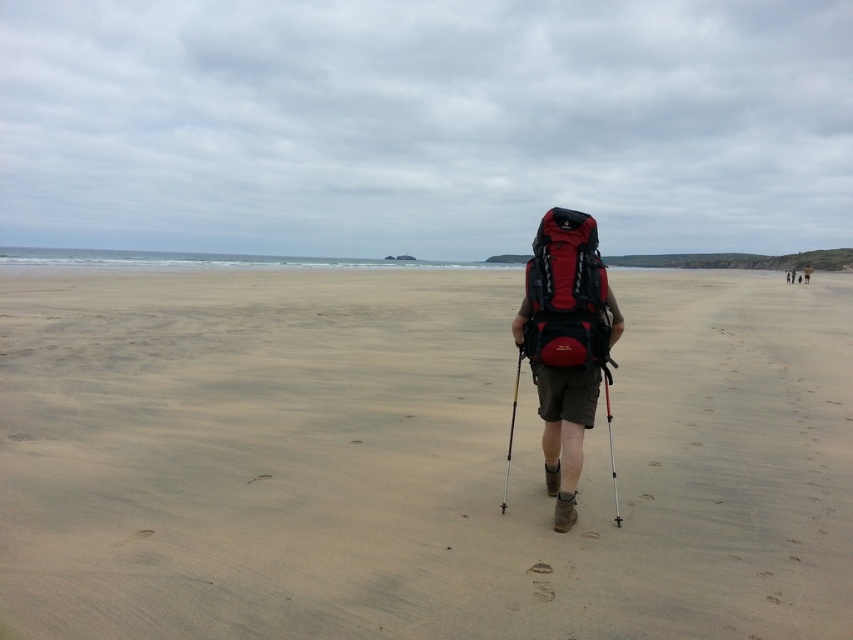
You are a photographer trying to capture the smooth sand at center and the red matte backpack at center in a single shot. Which object should you focus on first to ensure both are in sharp focus?

The smooth sand at center is closer to the viewer than the red matte backpack at center. To ensure both are in sharp focus, you should focus on the smooth sand at center first, as focusing on closer objects sets the focal plane to include both near and far subjects.

You are a photographer standing on the beach. You want to take a picture of the smooth sand at center and the red matte backpack at center so that both are clearly visible in the frame. Given that your camera has a maximum focus range of 5 meters, will you be able to capture both objects in focus at the same time?

The smooth sand at center and red matte backpack at center are 6.75 meters apart. Since the camera can only focus within 5 meters, the distance between them exceeds the focus range. Therefore, you cannot capture both objects in focus simultaneously.